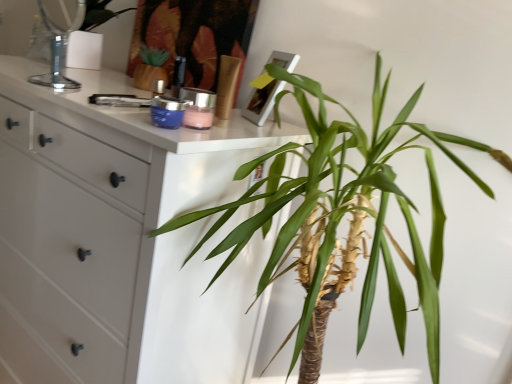
Question: Is green leafy plant at center positioned with its back to white matte chest of drawers at left?

Choices:
 (A) no
 (B) yes

Answer: (A)

Question: Does green leafy plant at center come behind white matte chest of drawers at left?

Choices:
 (A) yes
 (B) no

Answer: (B)

Question: Is green leafy plant at center in front of white matte chest of drawers at left?

Choices:
 (A) no
 (B) yes

Answer: (B)

Question: Can you confirm if green leafy plant at center is thinner than white matte chest of drawers at left?

Choices:
 (A) yes
 (B) no

Answer: (A)

Question: From the image's perspective, is green leafy plant at center on top of white matte chest of drawers at left?

Choices:
 (A) yes
 (B) no

Answer: (A)

Question: From the image's perspective, is green leafy plant at center located above or below white matte chest of drawers at left?

Choices:
 (A) above
 (B) below

Answer: (A)

Question: Is green leafy plant at center taller or shorter than white matte chest of drawers at left?

Choices:
 (A) short
 (B) tall

Answer: (A)

Question: In terms of size, does green leafy plant at center appear bigger or smaller than white matte chest of drawers at left?

Choices:
 (A) big
 (B) small

Answer: (B)

Question: Would you say green leafy plant at center is inside or outside white matte chest of drawers at left?

Choices:
 (A) outside
 (B) inside

Answer: (A)

Question: From the image's perspective, is white matte chest of drawers at left located above or below shiny gold lotion at center?

Choices:
 (A) below
 (B) above

Answer: (A)

Question: From a real-world perspective, is white matte chest of drawers at left positioned above or below shiny gold lotion at center?

Choices:
 (A) below
 (B) above

Answer: (A)

Question: Considering the positions of point (67, 354) and point (226, 96), is point (67, 354) closer or farther from the camera than point (226, 96)?

Choices:
 (A) farther
 (B) closer

Answer: (A)

Question: Is white matte chest of drawers at left taller or shorter than shiny gold lotion at center?

Choices:
 (A) short
 (B) tall

Answer: (B)

Question: Is point (324, 205) positioned closer to the camera than point (62, 51)?

Choices:
 (A) farther
 (B) closer

Answer: (B)

Question: In the image, is green leafy plant at center on the left side or the right side of clear glass mirror at upper left?

Choices:
 (A) left
 (B) right

Answer: (B)